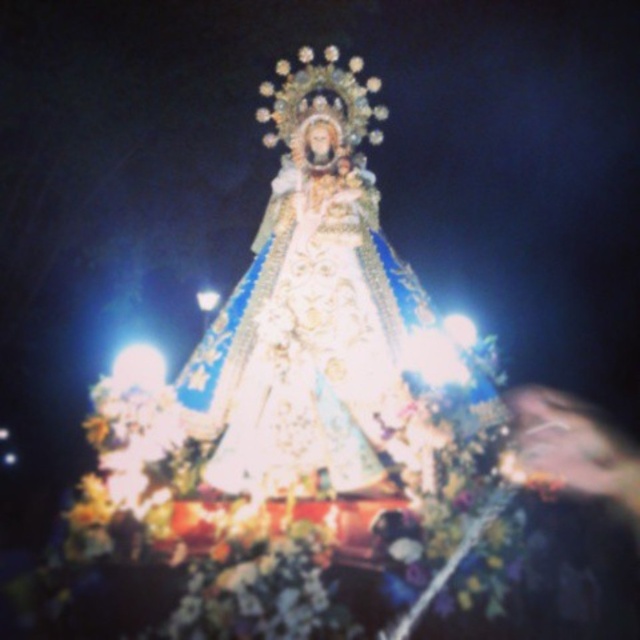
Between white satin dress at center and smooth skin face at lower right, which one appears on the right side from the viewer's perspective?

smooth skin face at lower right is more to the right.

Is white satin dress at center to the left of smooth skin face at lower right from the viewer's perspective?

Indeed, white satin dress at center is positioned on the left side of smooth skin face at lower right.

The width and height of the screenshot is (640, 640). What do you see at coordinates (308, 352) in the screenshot? I see `white satin dress at center` at bounding box center [308, 352].

Identify the location of white satin dress at center. Image resolution: width=640 pixels, height=640 pixels. (308, 352).